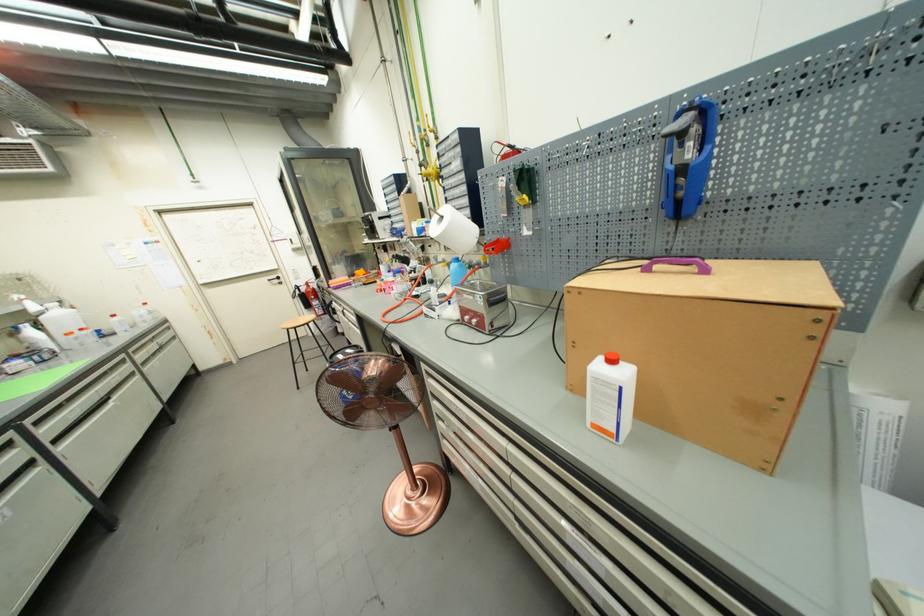
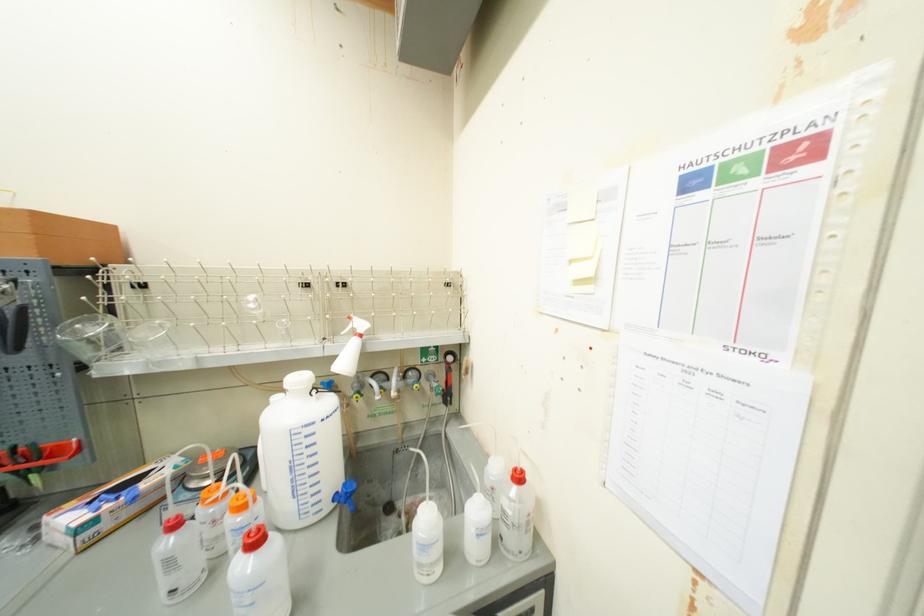
In the second image, find the point that corresponds to pixel 155 310 in the first image.

(515, 514)